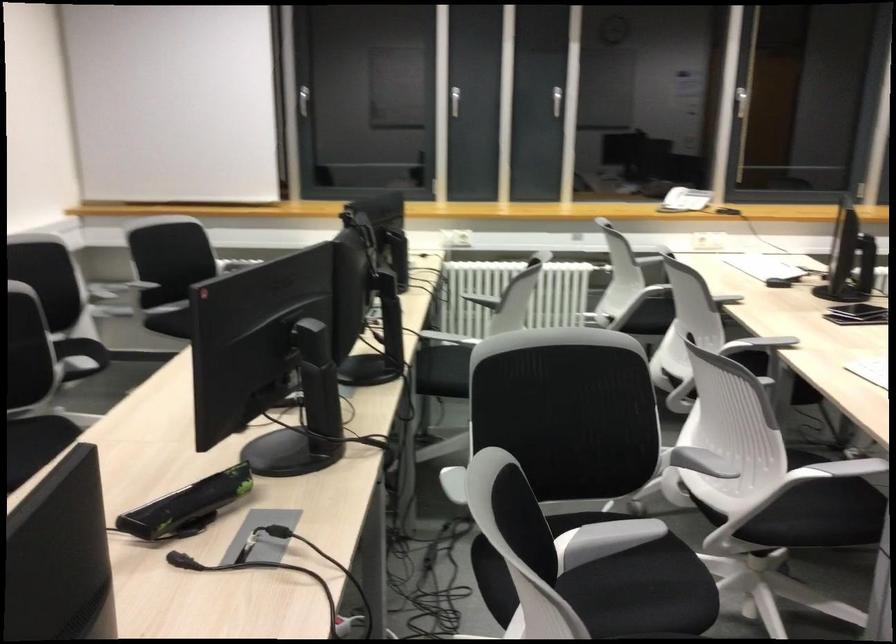
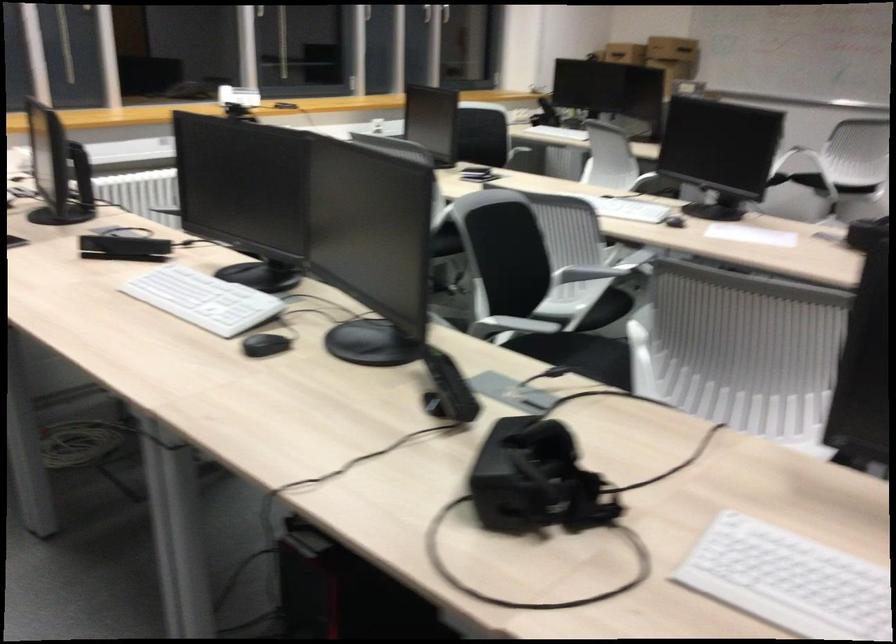
The point at [795,518] is marked in the first image. Where is the corresponding point in the second image?

(607, 308)